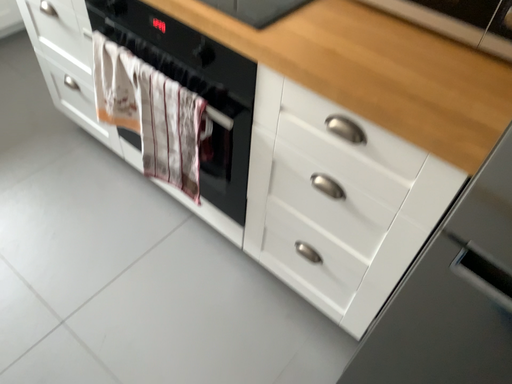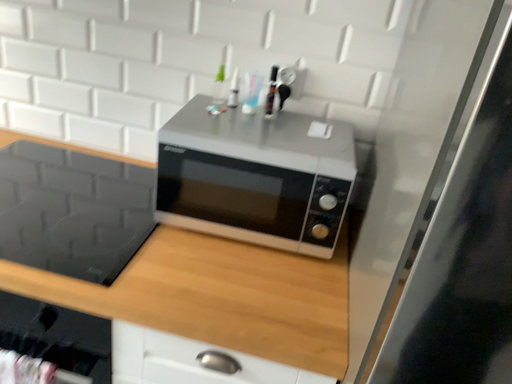
Question: Which way did the camera rotate in the video?

Choices:
 (A) rotated upward
 (B) rotated downward

Answer: (A)